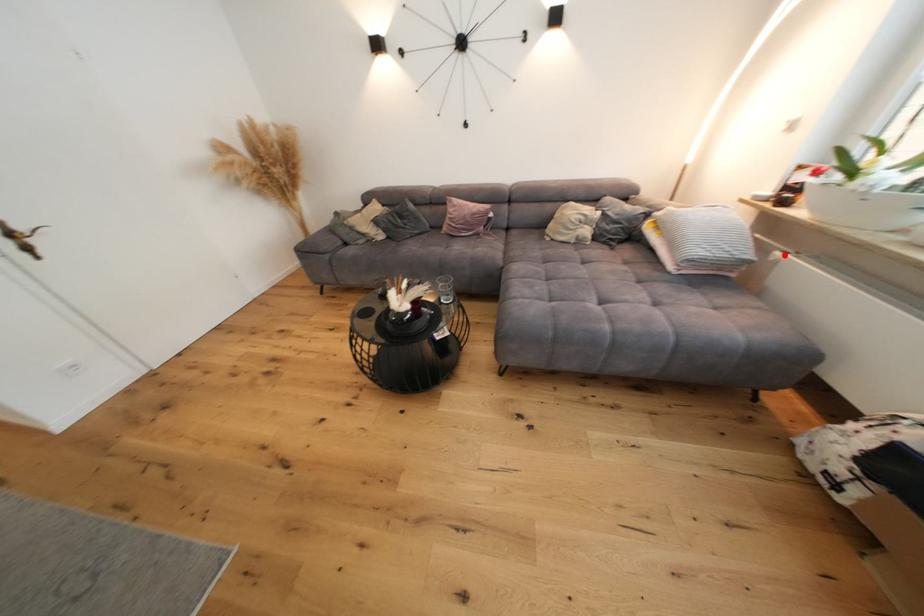
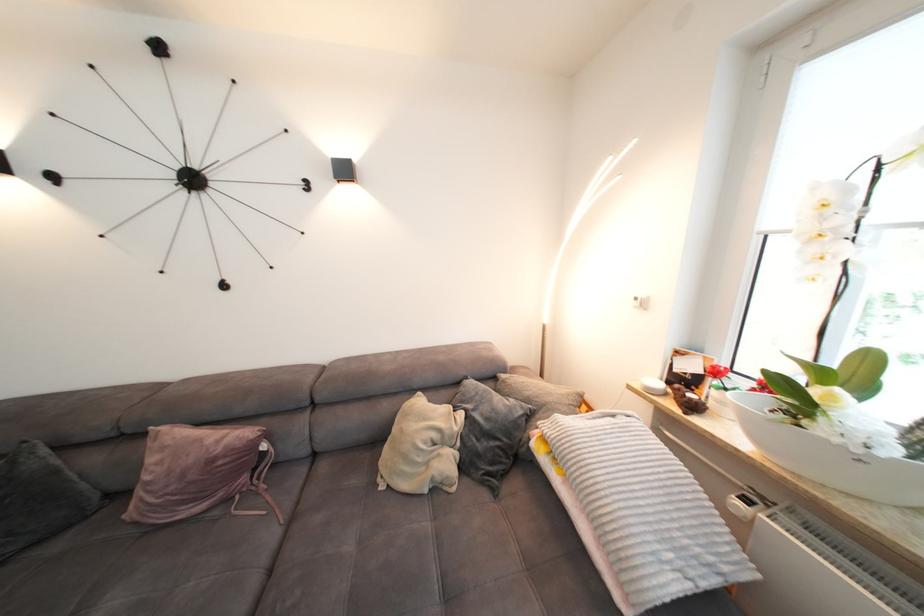
Where in the second image is the point corresponding to the highlighted location from the first image?

(746, 505)